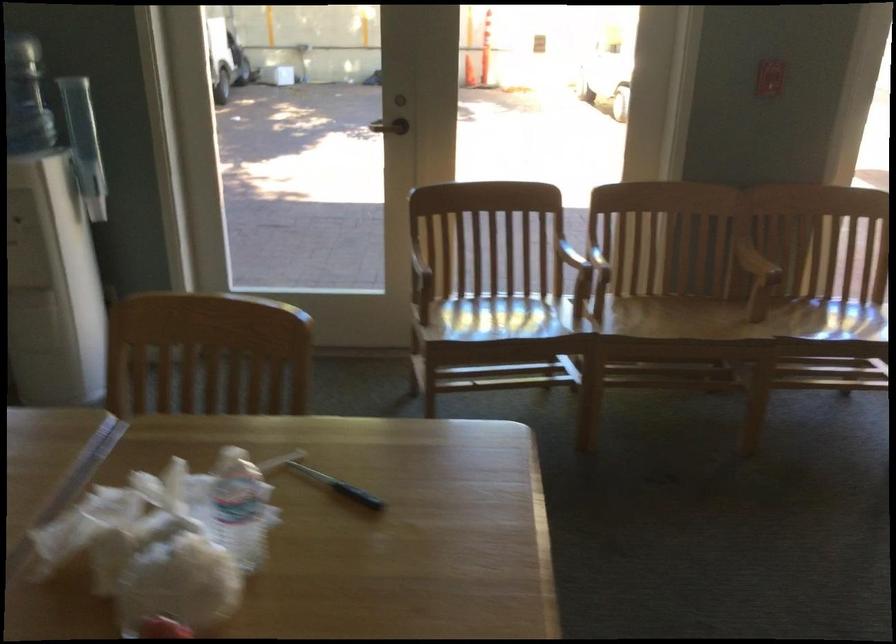
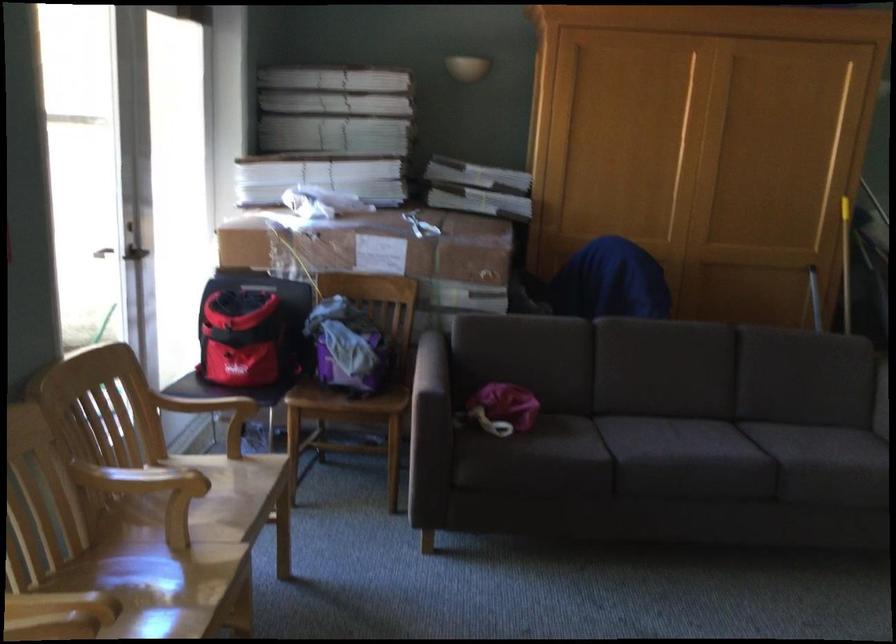
In the second image, find the point that corresponds to point (735, 327) in the first image.

(169, 590)